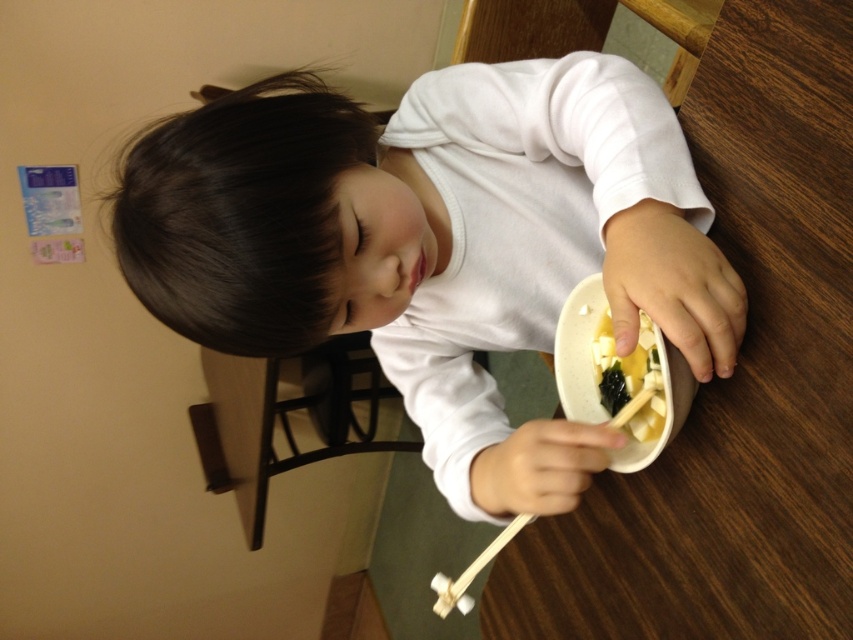
The child is trying to pick up the yellow matte tofu at center with chopsticks. Is there a risk that the tofu might spill onto the white matte shirt at center?

The white matte shirt at center is above the yellow matte tofu at center, so the tofu is below the shirt. Therefore, there is no risk of the tofu spilling onto the white matte shirt at center.

You are a photographer standing in front of the white matte shirt at center. You want to take a photo of the shirt without any distortion. What is the minimum distance you should maintain from the shirt to ensure clarity?

The minimum distance you should maintain from the white matte shirt at center is 17.48 inches to ensure clarity and avoid distortion.